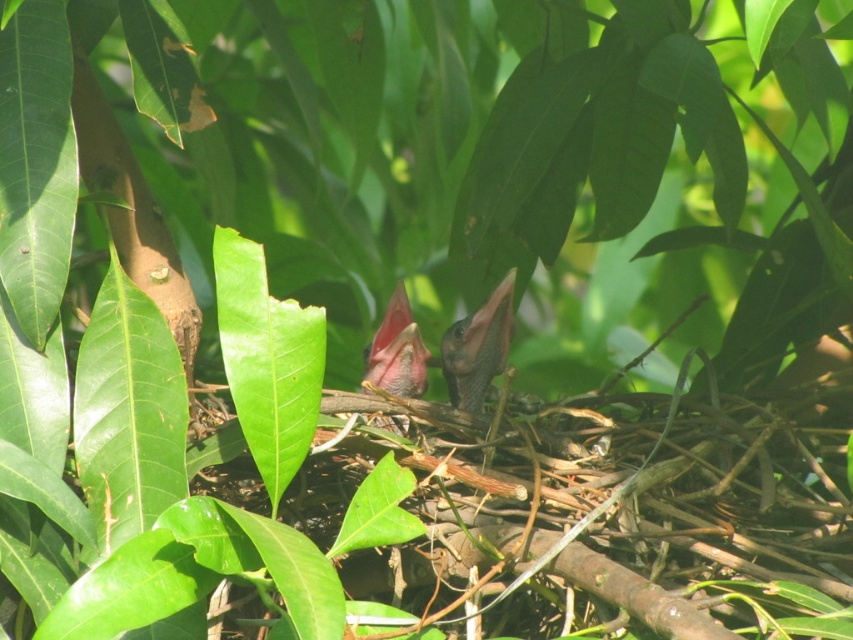
Can you confirm if smooth black beak at center is wider than pink matte beak at center?

Indeed, smooth black beak at center has a greater width compared to pink matte beak at center.

Looking at this image, does smooth black beak at center have a greater height compared to pink matte beak at center?

Indeed, smooth black beak at center has a greater height compared to pink matte beak at center.

Between point (445, 353) and point (402, 394), which one is positioned in front?

Point (402, 394)

Where is `smooth black beak at center`? This screenshot has height=640, width=853. smooth black beak at center is located at coordinates (479, 348).